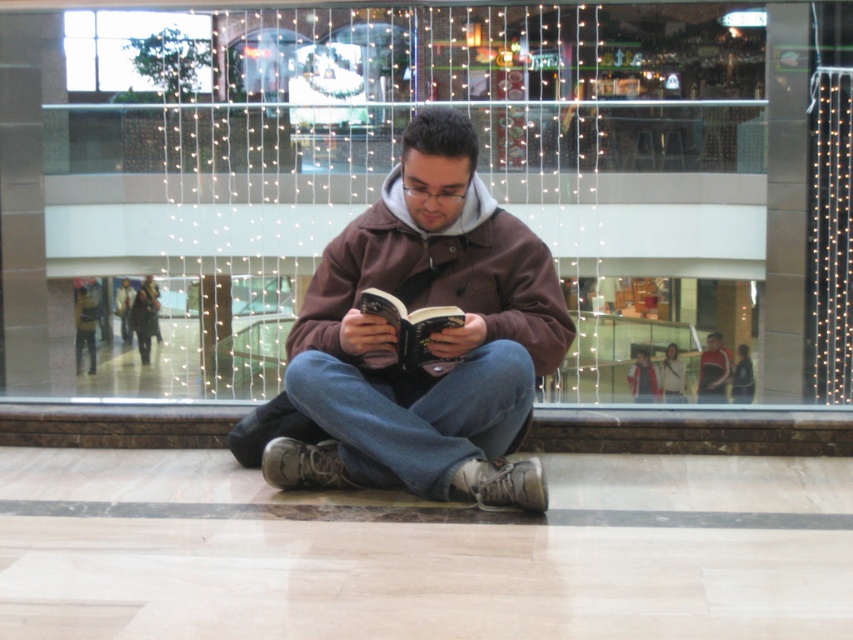
You are a store manager checking the fitting room. You have a customer trying on the brown soft hoodie at center and the matte black jacket at center. The customer says both fit well, but they want to know which one has a more compact size for easier carrying. Based on the image, which garment should you recommend?

The brown soft hoodie at center is smaller than the matte black jacket at center, so the brown soft hoodie at center is more compact and easier to carry.

You are a fashion designer observing a man in a mall. You notice the brown soft hoodie at center and the matte black jacket at center. Which clothing item is located to the left when viewed from the observer perspective?

The brown soft hoodie at center is positioned on the left side of matte black jacket at center, so it is located to the left when viewed from the observer perspective.

You are a delivery person carrying a box that is 10 inches wide. You need to place it between the brown soft hoodie at center and the hardcover book at center. Is there enough space?

The distance between the brown soft hoodie at center and the hardcover book at center is 9.22 inches. Since the box is 10 inches wide, it won not fit between them as the space is narrower than the box.